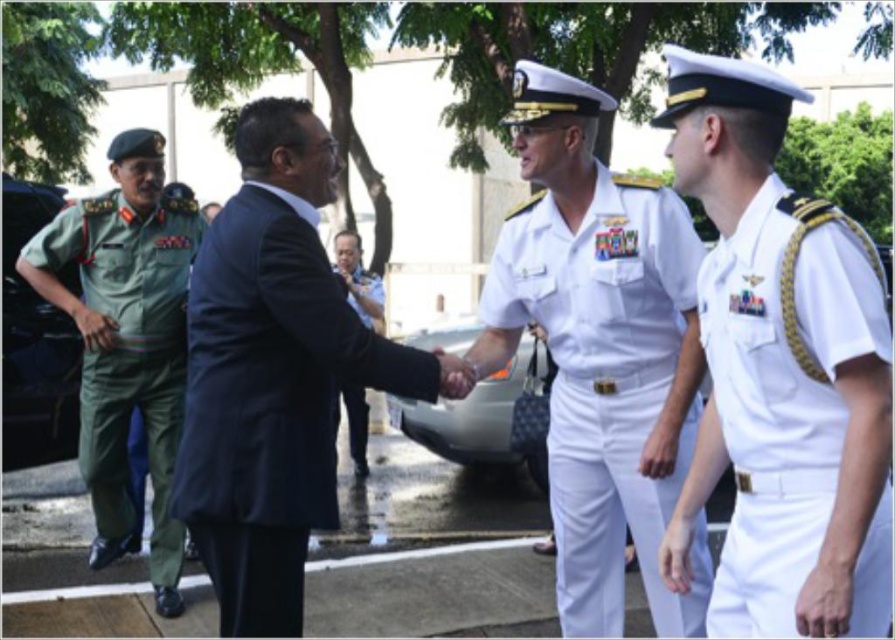
Question: Which object is the farthest from the navy blue fabric suit at center?

Choices:
 (A) white cotton uniform at center
 (B) white cotton shirt at right
 (C) dark blue suit at center

Answer: (C)

Question: Which object is the farthest from the green fabric uniform at left?

Choices:
 (A) white cotton shirt at right
 (B) white cotton uniform at center
 (C) dark blue suit at center

Answer: (A)

Question: Can you confirm if white cotton uniform at center is positioned below green fabric uniform at left?

Choices:
 (A) yes
 (B) no

Answer: (A)

Question: Is green fabric uniform at left wider than dark blue suit at center?

Choices:
 (A) yes
 (B) no

Answer: (A)

Question: Which object is the farthest from the white cotton shirt at right?

Choices:
 (A) green fabric uniform at left
 (B) dark blue suit at center

Answer: (B)

Question: In this image, where is green fabric uniform at left located relative to dark blue suit at center?

Choices:
 (A) above
 (B) below

Answer: (B)